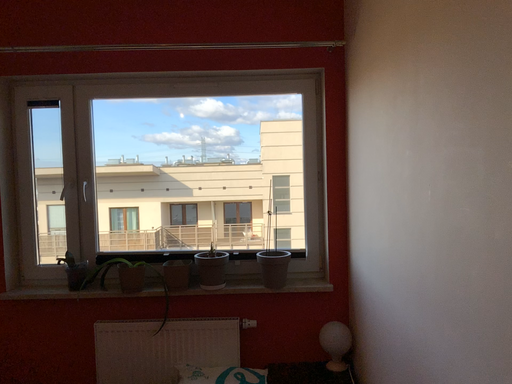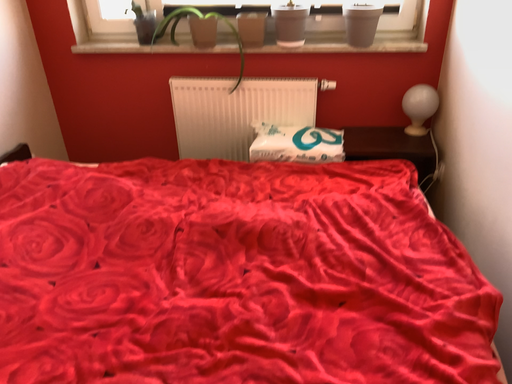
Question: How did the camera likely rotate when shooting the video?

Choices:
 (A) rotated downward
 (B) rotated upward

Answer: (A)